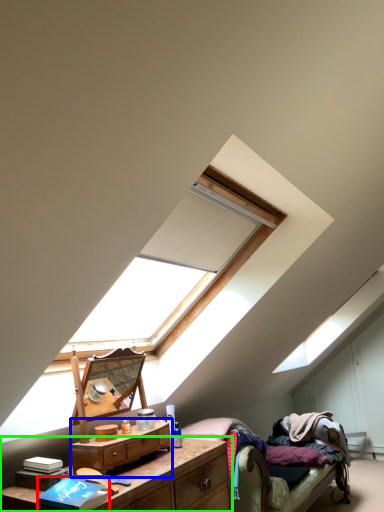
Question: Considering the real-world distances, which object is closest to book (highlighted by a red box)? nightstand (highlighted by a blue box) or nightstand (highlighted by a green box).

Choices:
 (A) nightstand
 (B) nightstand

Answer: (A)